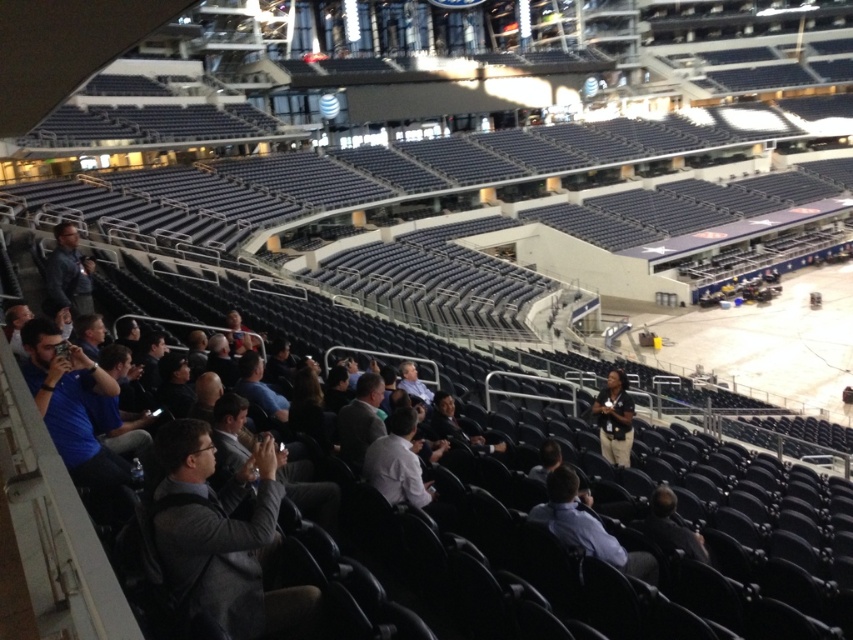
You are standing at the entrance of the arena and see the point marked at coordinates (614,419). What is the closest object to that point?

The dark gray shirt at center is located at point (614,419), so the closest object to that point is the dark gray shirt at center.

You are attending an indoor event and notice two people in the crowd. One is wearing a light blue shirt at center and another in a dark gray jacket at left. From your current position at the back of the stadium, which person is closer to you?

The light blue shirt at center is below dark gray jacket at left, so the dark gray jacket at left is closer to you.